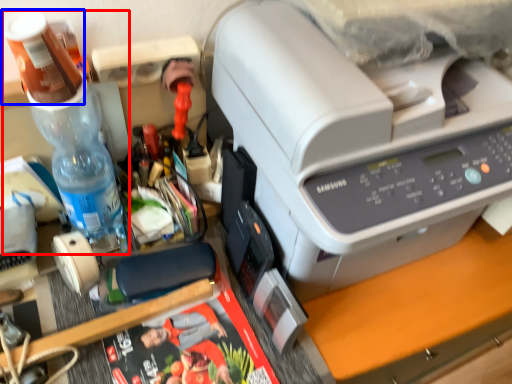
Question: Which point is further to the camera, bottle (highlighted by a red box) or stationery (highlighted by a blue box)?

Choices:
 (A) bottle
 (B) stationery

Answer: (A)